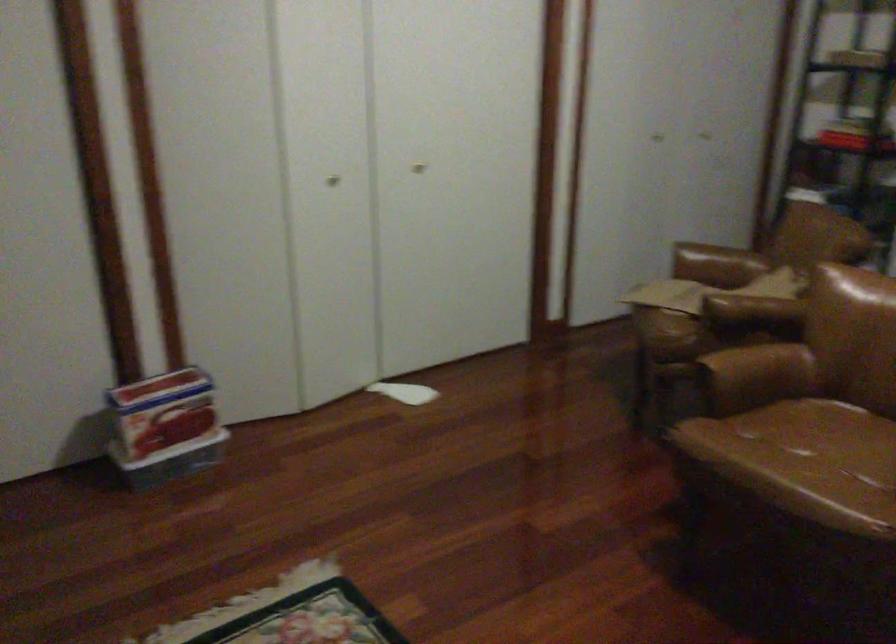
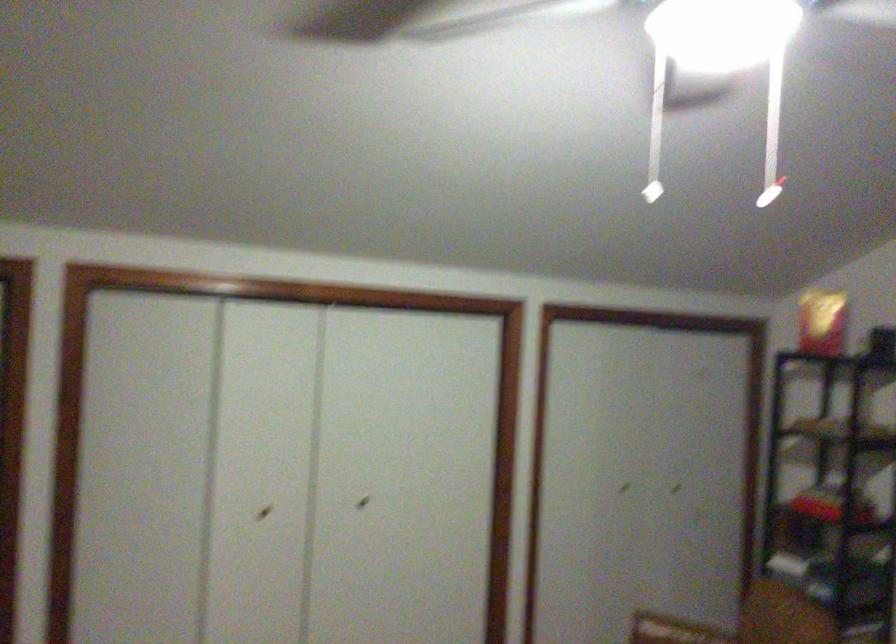
Find the pixel in the second image that matches (x=661, y=120) in the first image.

(623, 488)